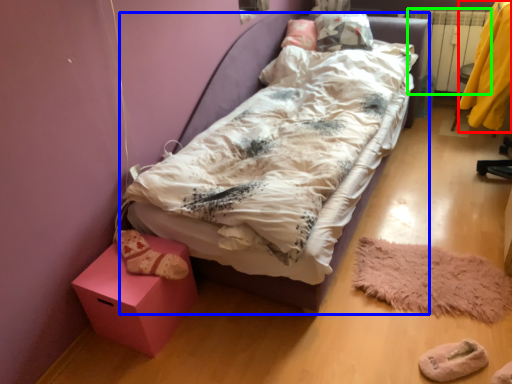
Question: Considering the real-world distances, which object is farthest from clothing (highlighted by a red box)? bed (highlighted by a blue box) or radiator (highlighted by a green box)?

Choices:
 (A) bed
 (B) radiator

Answer: (A)